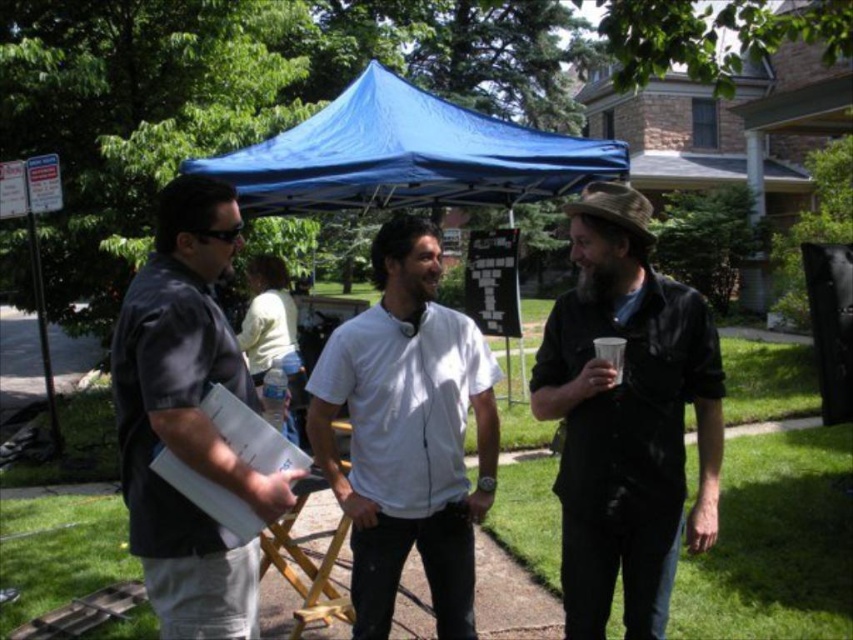
Question: Is black matte shirt at center wider than blue fabric canopy at center?

Choices:
 (A) no
 (B) yes

Answer: (A)

Question: Does white matte shirt at center have a smaller size compared to dark gray shirt at left?

Choices:
 (A) yes
 (B) no

Answer: (B)

Question: Is blue fabric canopy at center to the left of clear plastic water bottle at center from the viewer's perspective?

Choices:
 (A) yes
 (B) no

Answer: (B)

Question: Which object is farther from the camera taking this photo?

Choices:
 (A) clear plastic water bottle at center
 (B) transparent plastic cup at right
 (C) white matte shirt at center
 (D) dark gray shirt at left

Answer: (A)

Question: Among these objects, which one is farthest from the camera?

Choices:
 (A) blue fabric canopy at center
 (B) dark gray shirt at left
 (C) black matte shirt at center

Answer: (A)

Question: Which object is positioned farthest from the blue fabric canopy at center?

Choices:
 (A) white matte shirt at center
 (B) dark gray shirt at left
 (C) black matte shirt at center

Answer: (B)